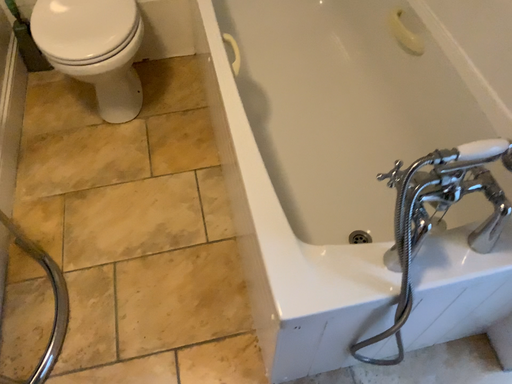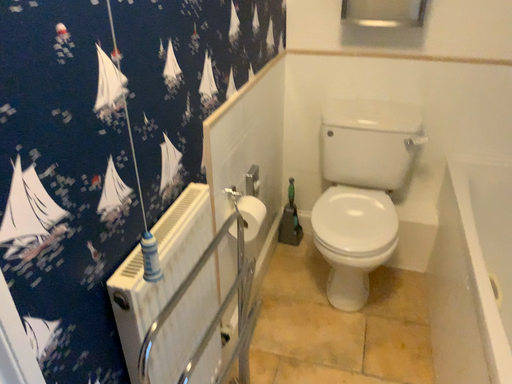
Question: How did the camera likely rotate when shooting the video?

Choices:
 (A) rotated upward
 (B) rotated downward

Answer: (A)